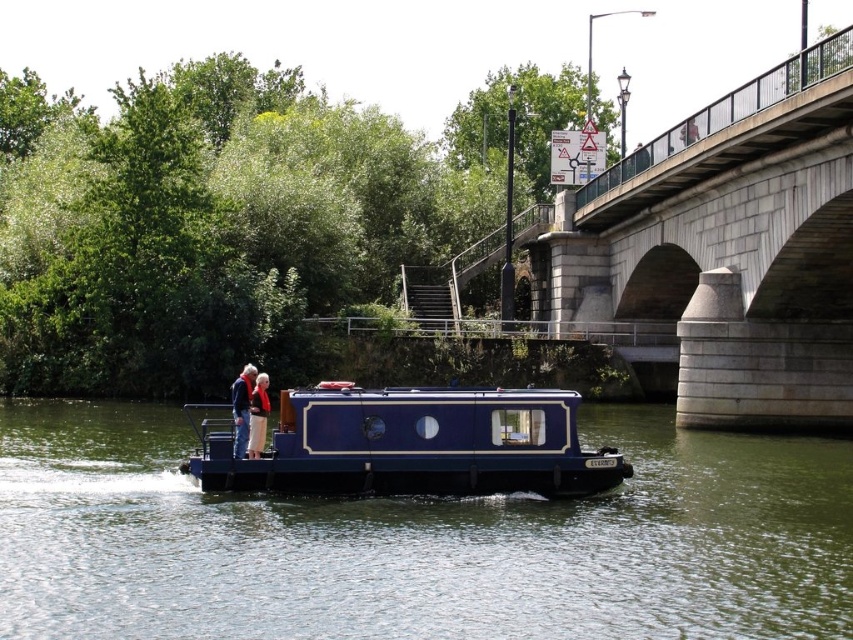
Question: Observing the image, what is the correct spatial positioning of blue polished wood houseboat at center in reference to light beige pants at center?

Choices:
 (A) above
 (B) below

Answer: (B)

Question: Is blue polished wood houseboat at center above blue fabric jacket at center?

Choices:
 (A) no
 (B) yes

Answer: (A)

Question: Based on their relative distances, which object is nearer to the blue fabric jacket at center?

Choices:
 (A) blue glossy houseboat at center
 (B) light beige pants at center

Answer: (B)

Question: Considering the real-world distances, which object is farthest from the blue fabric jacket at center?

Choices:
 (A) light beige pants at center
 (B) blue glossy houseboat at center
 (C) blue polished wood houseboat at center

Answer: (B)

Question: Which point is closer to the camera?

Choices:
 (A) (254, 371)
 (B) (604, 420)
 (C) (490, 468)

Answer: (C)

Question: Is blue polished wood houseboat at center above blue fabric jacket at center?

Choices:
 (A) yes
 (B) no

Answer: (B)